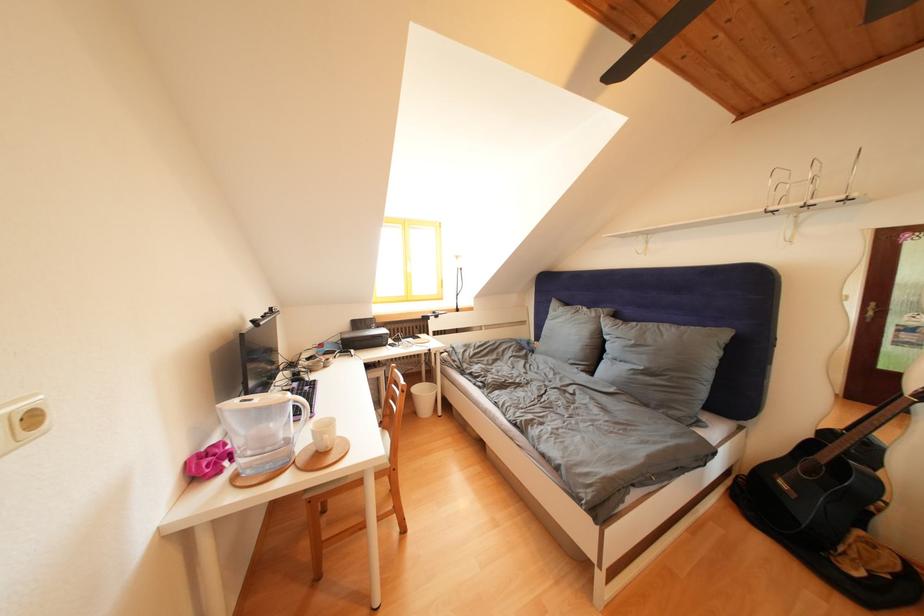
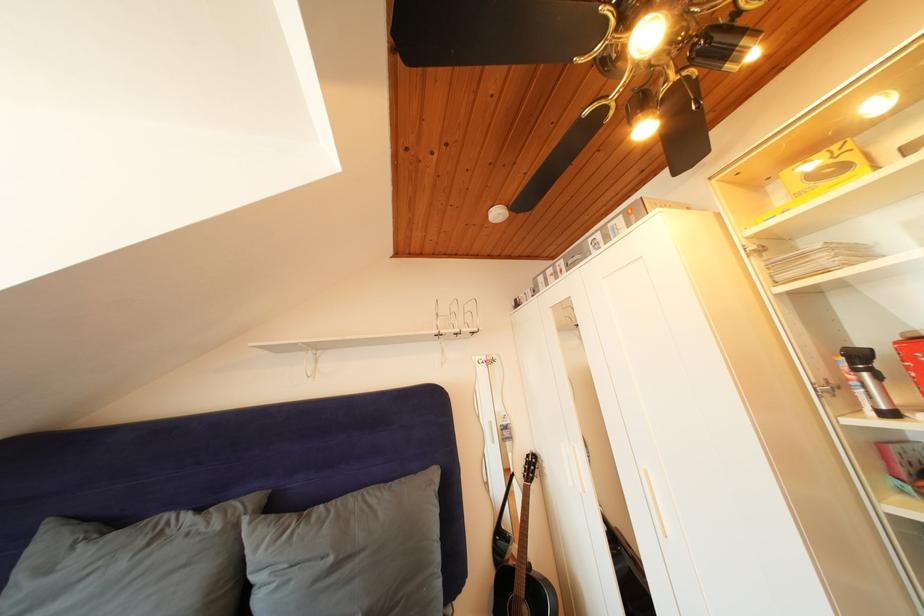
Find the pixel in the second image that matches pixel 602 320 in the first image.

(225, 531)